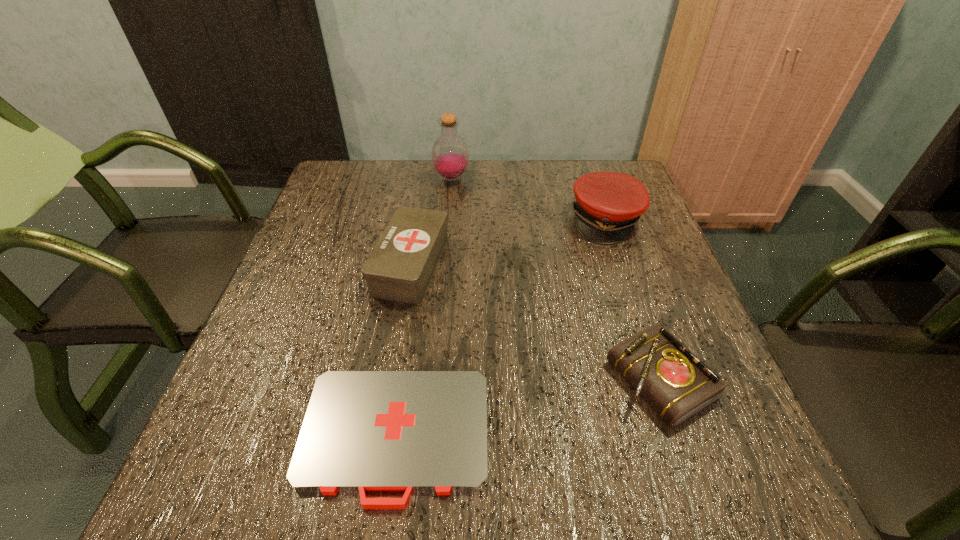
In the image, there is a desktop. Where is `vacant space at the far edge`? The width and height of the screenshot is (960, 540). vacant space at the far edge is located at coordinates (555, 198).

This screenshot has width=960, height=540. In order to click on vacant space at the near edge of the desktop in this screenshot , I will do `click(399, 496)`.

Image resolution: width=960 pixels, height=540 pixels. Identify the location of vacant area at the left edge. (340, 301).

The height and width of the screenshot is (540, 960). In order to click on free region at the right edge in this screenshot , I will do `click(648, 312)`.

The height and width of the screenshot is (540, 960). In the image, there is a desktop. In order to click on vacant space at the far left corner in this screenshot , I will do `click(334, 184)`.

The image size is (960, 540). In the image, there is a desktop. Identify the location of vacant space at the near right corner. (683, 492).

The image size is (960, 540). I want to click on vacant space that is in between the diary and the farthest object, so click(x=556, y=279).

This screenshot has width=960, height=540. Find the location of `free space between the taller first-aid kit and the fourth shortest object`. free space between the taller first-aid kit and the fourth shortest object is located at coordinates (509, 242).

Find the location of a particular element. The height and width of the screenshot is (540, 960). vacant point located between the shortest object and the second tallest object is located at coordinates (500, 328).

The width and height of the screenshot is (960, 540). Find the location of `blank region between the second tallest object and the fourth tallest object`. blank region between the second tallest object and the fourth tallest object is located at coordinates (633, 300).